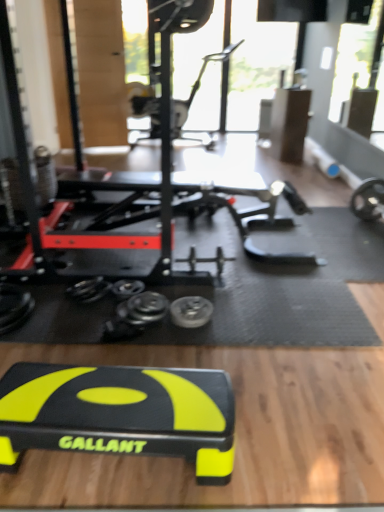
Question: Should I look upward or downward to see black rubber step platform at center, arranged as the first sport equipment when viewed from the front?

Choices:
 (A) down
 (B) up

Answer: (A)

Question: Considering the relative sizes of metallic silver weight at center and black rubber step platform at center, arranged as the 2th sport equipment when viewed from the top, in the image provided, is metallic silver weight at center bigger than black rubber step platform at center, arranged as the 2th sport equipment when viewed from the top,?

Choices:
 (A) no
 (B) yes

Answer: (A)

Question: Is metallic silver weight at center outside of black rubber step platform at center, arranged as the first sport equipment when viewed from the front?

Choices:
 (A) yes
 (B) no

Answer: (A)

Question: From a real-world perspective, is metallic silver weight at center under black rubber step platform at center, which is the second sport equipment in back-to-front order?

Choices:
 (A) yes
 (B) no

Answer: (A)

Question: Is metallic silver weight at center looking in the opposite direction of black rubber step platform at center, arranged as the first sport equipment when viewed from the front?

Choices:
 (A) yes
 (B) no

Answer: (B)

Question: Does metallic silver weight at center have a greater height compared to black rubber step platform at center, the first sport equipment from the bottom?

Choices:
 (A) yes
 (B) no

Answer: (B)

Question: Is metallic silver weight at center closer to camera compared to black rubber step platform at center, which is the second sport equipment in back-to-front order?

Choices:
 (A) no
 (B) yes

Answer: (A)

Question: Is metallic silver exercise bike at upper center, which is counted as the 2th sport equipment, starting from the front, facing towards black rubber step platform at center, which is the second sport equipment in back-to-front order?

Choices:
 (A) no
 (B) yes

Answer: (B)

Question: Is metallic silver exercise bike at upper center, which is counted as the 2th sport equipment, starting from the front, directly adjacent to black rubber step platform at center, arranged as the 2th sport equipment when viewed from the top?

Choices:
 (A) no
 (B) yes

Answer: (A)

Question: Does metallic silver exercise bike at upper center, which is counted as the 2th sport equipment, starting from the front, appear on the right side of black rubber step platform at center, arranged as the first sport equipment when viewed from the front?

Choices:
 (A) no
 (B) yes

Answer: (B)

Question: Is black rubber step platform at center, which is the second sport equipment in back-to-front order, a part of metallic silver exercise bike at upper center, which is the 2th sport equipment in bottom-to-top order?

Choices:
 (A) no
 (B) yes

Answer: (A)

Question: From the image's perspective, is metallic silver exercise bike at upper center, which is counted as the 2th sport equipment, starting from the front, on top of black rubber step platform at center, arranged as the first sport equipment when viewed from the front?

Choices:
 (A) yes
 (B) no

Answer: (A)

Question: Does metallic silver exercise bike at upper center, which is the 2th sport equipment in bottom-to-top order, have a larger size compared to black rubber step platform at center, the first sport equipment from the bottom?

Choices:
 (A) yes
 (B) no

Answer: (A)

Question: Is black rubber step platform at center, the first sport equipment from the bottom, not close to metallic silver weight at center?

Choices:
 (A) no
 (B) yes

Answer: (A)